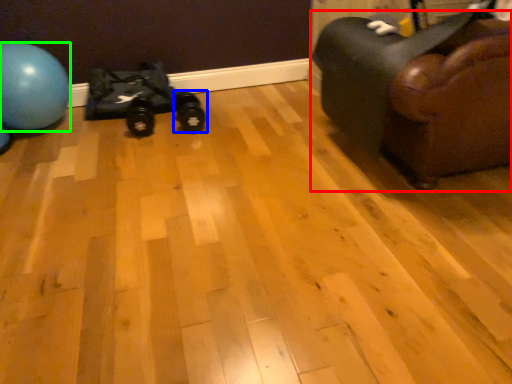
Question: Which object is the farthest from furniture (highlighted by a red box)? Choose among these: footwear (highlighted by a blue box) or ball (highlighted by a green box).

Choices:
 (A) footwear
 (B) ball

Answer: (B)